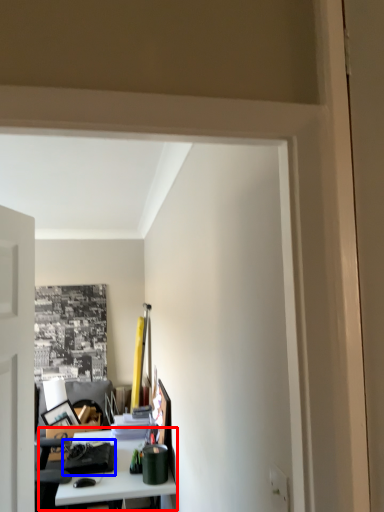
Question: Which object is further to the camera taking this photo, table (highlighted by a red box) or stationery (highlighted by a blue box)?

Choices:
 (A) table
 (B) stationery

Answer: (B)